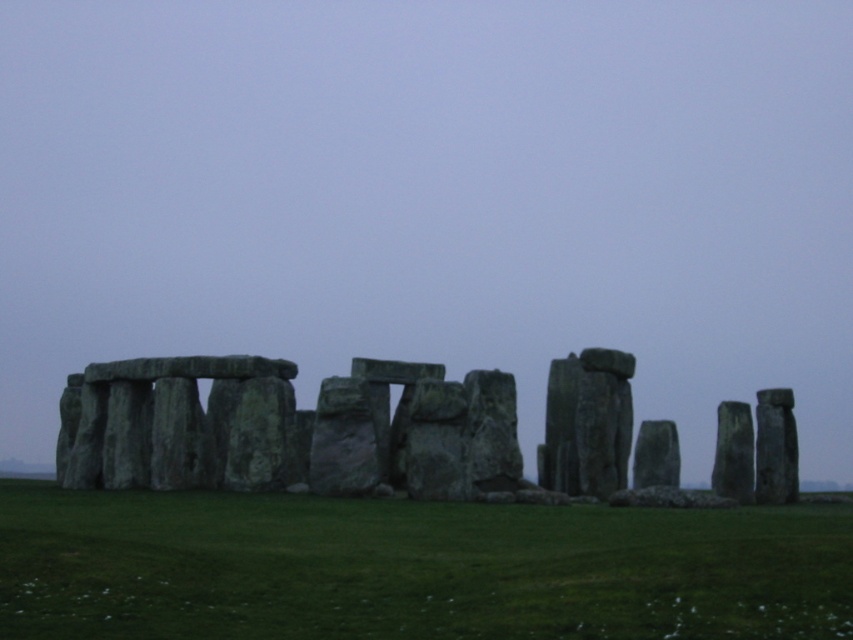
Can you confirm if green grass at center is positioned below green stone at center?

Yes, green grass at center is below green stone at center.

Can you confirm if green grass at center is taller than green stone at center?

In fact, green grass at center may be shorter than green stone at center.

At what (x,y) coordinates should I click in order to perform the action: click on green grass at center. Please return your answer as a coordinate pair (x, y). The width and height of the screenshot is (853, 640). Looking at the image, I should click on (412, 568).